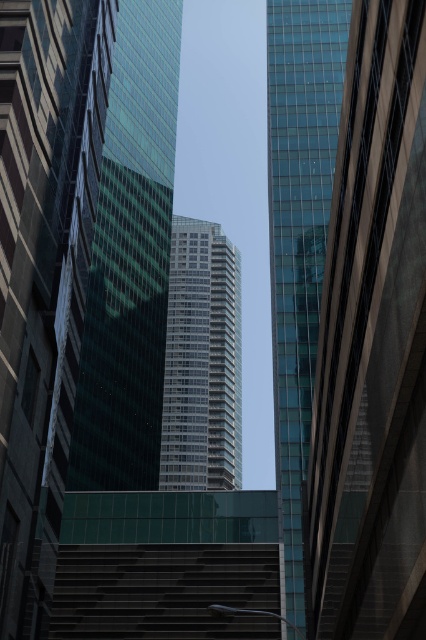
Can you confirm if glassy reflective skyscraper at right is positioned above transparent glass building at center?

No, glassy reflective skyscraper at right is not above transparent glass building at center.

Is glassy reflective skyscraper at right closer to the viewer compared to transparent glass building at center?

Yes, it is.

Who is more forward, (339,452) or (270,200)?

Point (339,452)

This screenshot has width=426, height=640. I want to click on glassy reflective skyscraper at right, so click(373, 342).

Can you confirm if glassy reflective skyscraper at right is positioned to the right of dark gray concrete stairs at lower center?

Yes, glassy reflective skyscraper at right is to the right of dark gray concrete stairs at lower center.

Is point (321, 440) in front of point (255, 637)?

Yes, it is in front of point (255, 637).

Is point (321, 561) closer to camera compared to point (78, 566)?

Yes, point (321, 561) is closer to viewer.

This screenshot has height=640, width=426. In order to click on glassy reflective skyscraper at right in this screenshot , I will do `click(373, 342)`.

Is point (282, 193) less distant than point (111, 596)?

No, it is not.

Does transparent glass building at center have a greater height compared to dark gray concrete stairs at lower center?

Correct, transparent glass building at center is much taller as dark gray concrete stairs at lower center.

This screenshot has height=640, width=426. In order to click on transparent glass building at center in this screenshot , I will do `click(299, 241)`.